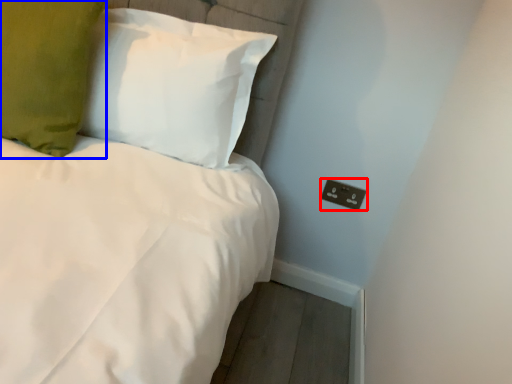
Question: Which of the following is the farthest to the observer, electric outlet (highlighted by a red box) or pillow (highlighted by a blue box)?

Choices:
 (A) electric outlet
 (B) pillow

Answer: (A)